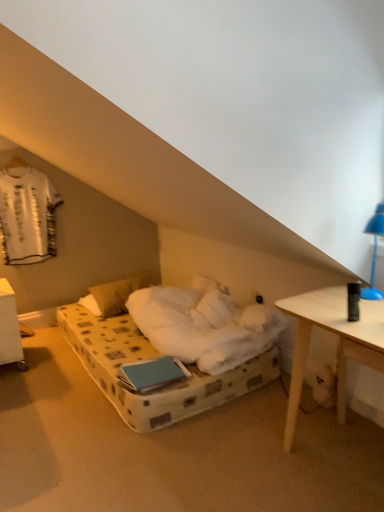
Where is `free location in front of white plastic nightstand at lower left`? The width and height of the screenshot is (384, 512). free location in front of white plastic nightstand at lower left is located at coordinates pyautogui.click(x=21, y=379).